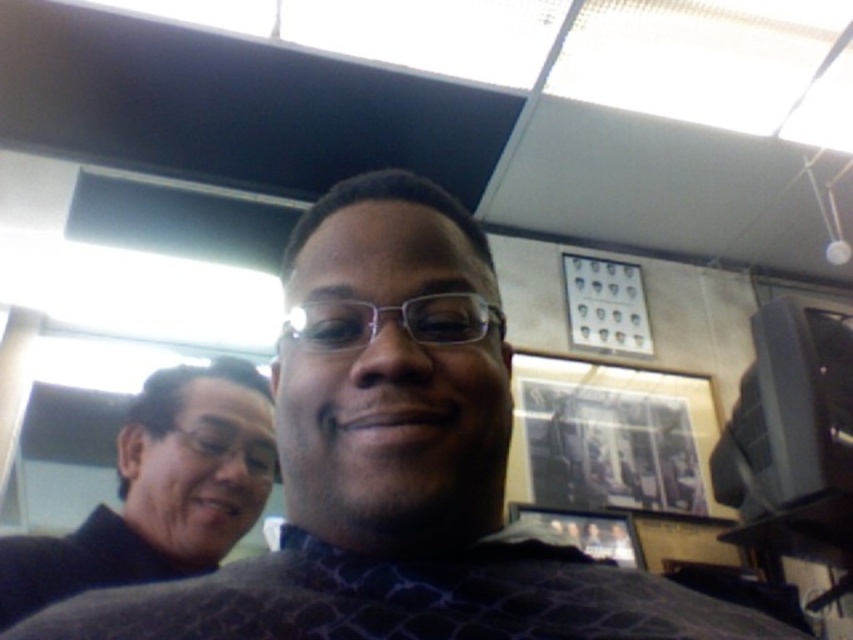
You are standing in the office scene described. You need to locate the matte black shirt at center. According to the coordinates provided, where would you find it in the image?

The matte black shirt at center is located at coordinates point (397, 465) in the image.

You are standing in an office and see the matte black shirt at center and the black matte sweater at left. Which one is taller?

The matte black shirt at center is much taller than the black matte sweater at left.

You are standing in the office scene described. There is a point at coordinates (397, 465). What object is located at this point?

The point at coordinates (397, 465) corresponds to the matte black shirt at center.